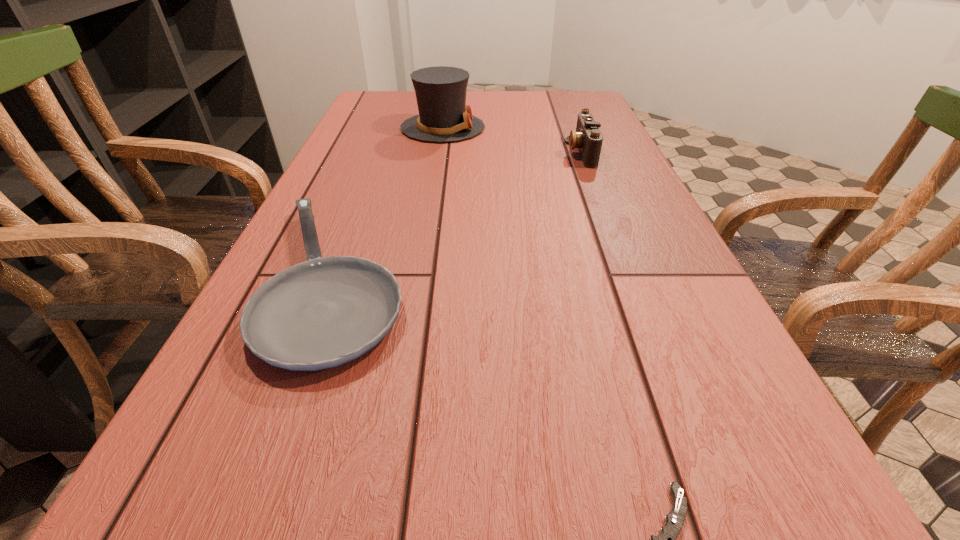
You are a GUI agent. You are given a task and a screenshot of the screen. Output one action in this format:
    pyautogui.click(x=<x>, y=<y>)
    Task: Click on the dress hat
    The image size is (960, 540).
    Given the screenshot: What is the action you would take?
    tap(440, 91)

Where is `camera`? Image resolution: width=960 pixels, height=540 pixels. camera is located at coordinates (588, 139).

Where is `frying pan`? The height and width of the screenshot is (540, 960). frying pan is located at coordinates (324, 312).

The width and height of the screenshot is (960, 540). In order to click on the third tallest object in this screenshot , I will do `click(324, 312)`.

I want to click on vacant space located with goggles on the front of the dress hat, so click(568, 128).

Locate an element on the screen. This screenshot has height=540, width=960. vacant space located on the front-facing side of the second tallest object is located at coordinates (464, 152).

At what (x,y) coordinates should I click in order to perform the action: click on blank space located 0.240m on the front-facing side of the second tallest object. Please return your answer as a coordinate pair (x, y). The width and height of the screenshot is (960, 540). Looking at the image, I should click on (475, 152).

Identify the location of vacant space located 0.160m on the front-facing side of the second tallest object. This screenshot has width=960, height=540. (506, 152).

This screenshot has width=960, height=540. Identify the location of vacant region located on the back of the third farthest object. (368, 195).

I want to click on object located in the far edge section of the desktop, so click(440, 91).